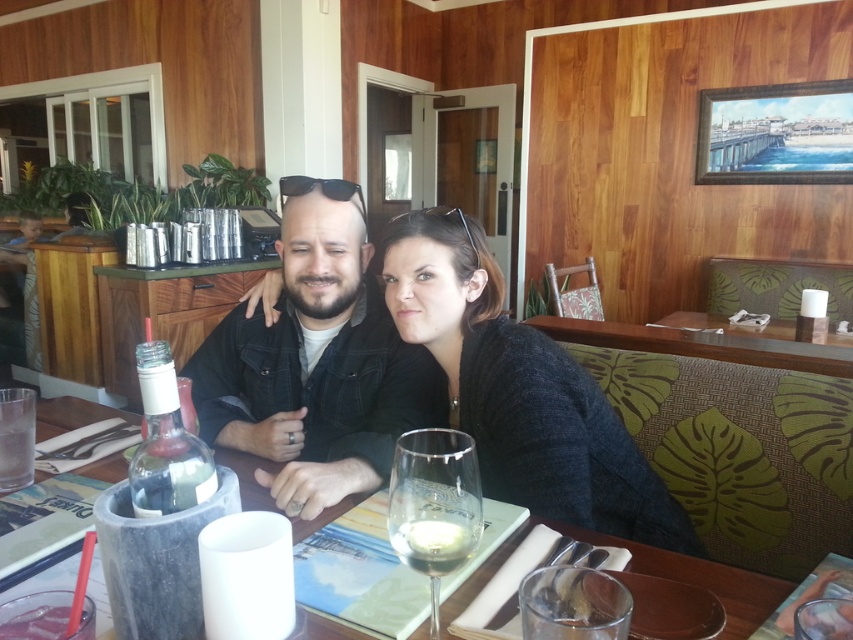
Can you confirm if dark gray sweater at center is smaller than translucent glass bottle at center?

No, dark gray sweater at center is not smaller than translucent glass bottle at center.

Does dark gray sweater at center appear on the right side of translucent glass bottle at center?

Yes, dark gray sweater at center is to the right of translucent glass bottle at center.

Who is more distant from viewer, (x=564, y=454) or (x=142, y=348)?

The point (x=564, y=454) is behind.

Identify the location of dark gray sweater at center. Image resolution: width=853 pixels, height=640 pixels. (521, 390).

Is clear glass wine glass at center shorter than clear glass wine at center?

No, clear glass wine glass at center is not shorter than clear glass wine at center.

Between point (399, 538) and point (467, 547), which one is positioned behind?

Point (399, 538)

Does point (428, 536) come behind point (447, 538)?

That is False.

Where is `clear glass wine glass at center`? clear glass wine glass at center is located at coordinates (434, 506).

Between translucent glass wine at center and translucent glass bottle at center, which one has more height?

translucent glass bottle at center

Is translucent glass wine at center wider than translucent glass bottle at center?

Yes, translucent glass wine at center is wider than translucent glass bottle at center.

Which is in front, point (80, 412) or point (151, 408)?

Point (151, 408) is more forward.

Where is `translucent glass wine at center`? This screenshot has width=853, height=640. translucent glass wine at center is located at coordinates (653, 573).